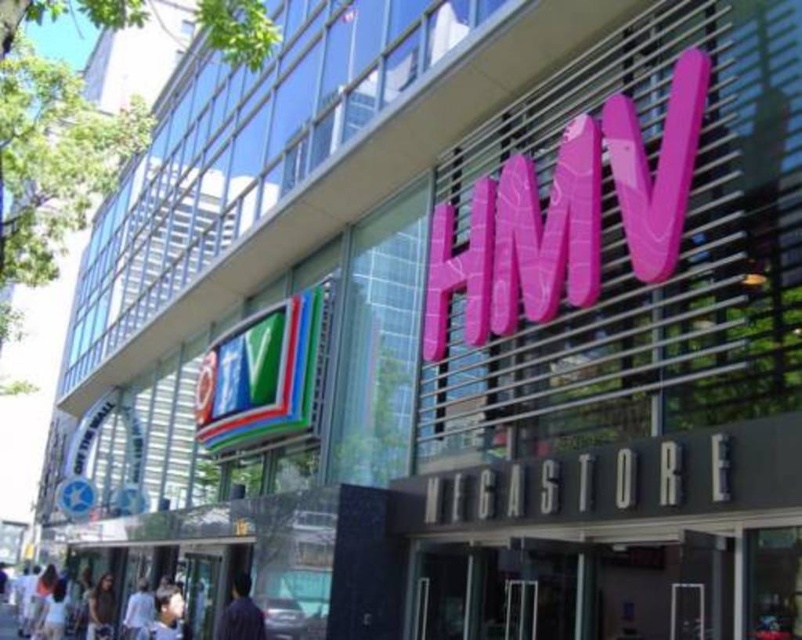
Locate an element on the screen. Image resolution: width=802 pixels, height=640 pixels. light blue shirt at lower left is located at coordinates (165, 616).

Identify the location of light blue shirt at lower left. (165, 616).

This screenshot has width=802, height=640. Describe the element at coordinates (241, 612) in the screenshot. I see `purple fabric shirt at lower left` at that location.

Can you confirm if purple fabric shirt at lower left is positioned to the right of white fabric shirt at lower left?

Correct, you'll find purple fabric shirt at lower left to the right of white fabric shirt at lower left.

Is point (246, 589) more distant than point (136, 634)?

No.

This screenshot has width=802, height=640. I want to click on purple fabric shirt at lower left, so click(241, 612).

Can you confirm if light blue shirt at lower left is bigger than white fabric shirt at lower left?

Yes.

Who is more distant from viewer, (156, 616) or (152, 595)?

Positioned behind is point (152, 595).

Image resolution: width=802 pixels, height=640 pixels. In order to click on light blue shirt at lower left in this screenshot , I will do `click(165, 616)`.

Find the location of `light blue shirt at lower left`. light blue shirt at lower left is located at coordinates [x=165, y=616].